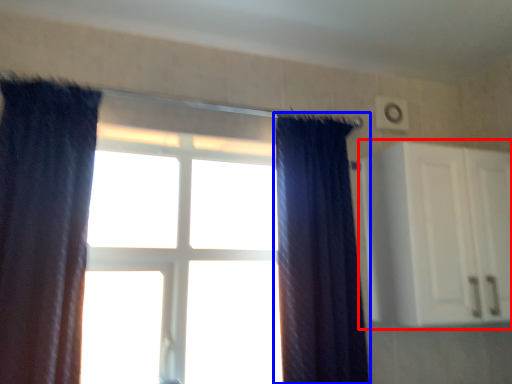
Question: Which point is further to the camera, cabinetry (highlighted by a red box) or curtain (highlighted by a blue box)?

Choices:
 (A) cabinetry
 (B) curtain

Answer: (A)